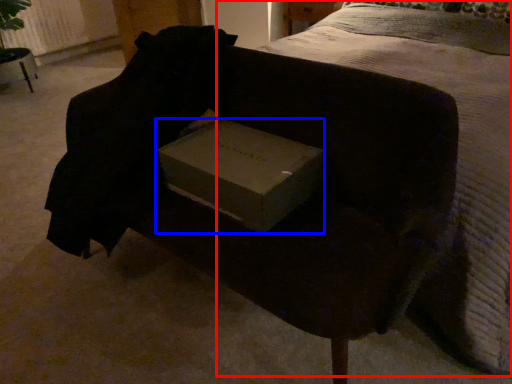
Question: Among these objects, which one is nearest to the camera, bed (highlighted by a red box) or box (highlighted by a blue box)?

Choices:
 (A) bed
 (B) box

Answer: (A)